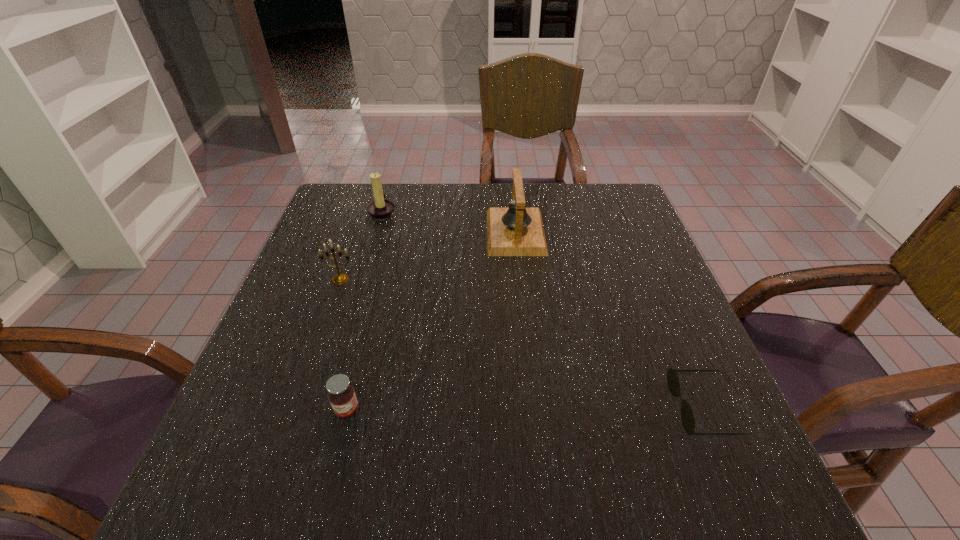
Locate an element on the screen. free spot between the second shortest object and the third farthest object is located at coordinates (344, 345).

Find the location of a particular element. The image size is (960, 540). free space between the nearer candelabrum and the second object from right to left is located at coordinates (428, 256).

You are a GUI agent. You are given a task and a screenshot of the screen. Output one action in this format:
    pyautogui.click(x=<x>, y=<y>)
    Task: Click on the free space that is in between the third nearest object and the fourth tallest object
    This screenshot has width=960, height=540.
    Given the screenshot: What is the action you would take?
    pyautogui.click(x=344, y=345)

Identify which object is the fourth closest to the third farthest object. Please provide its 2D coordinates. Your answer should be formatted as a tuple, i.e. [(x, y)], where the tuple contains the x and y coordinates of a point satisfying the conditions above.

[(673, 383)]

Point out which object is positioned as the nearest to the second shortest object. Please provide its 2D coordinates. Your answer should be formatted as a tuple, i.e. [(x, y)], where the tuple contains the x and y coordinates of a point satisfying the conditions above.

[(339, 279)]

Where is `free space in the image that satisfies the following two spatial constraints: 1. on the back side of the nearer candelabrum; 2. on the left side of the bell`? Image resolution: width=960 pixels, height=540 pixels. free space in the image that satisfies the following two spatial constraints: 1. on the back side of the nearer candelabrum; 2. on the left side of the bell is located at coordinates (357, 232).

This screenshot has height=540, width=960. What are the coordinates of `vacant space that satisfies the following two spatial constraints: 1. on the back side of the bell; 2. on the right side of the third nearest object` in the screenshot? It's located at (357, 232).

Where is `free space that satisfies the following two spatial constraints: 1. on the wick of the bell; 2. on the right side of the farther candelabrum`? This screenshot has width=960, height=540. free space that satisfies the following two spatial constraints: 1. on the wick of the bell; 2. on the right side of the farther candelabrum is located at coordinates (376, 232).